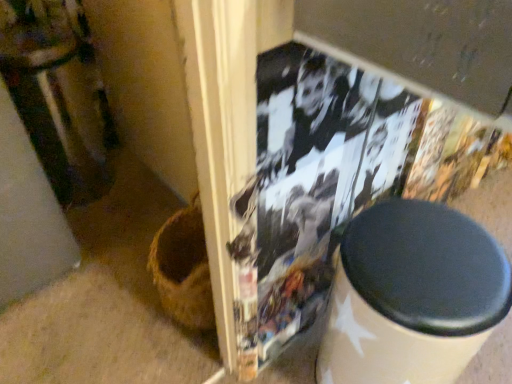
I want to click on vacant point above white matte waste container at lower right (from a real-world perspective), so click(x=424, y=255).